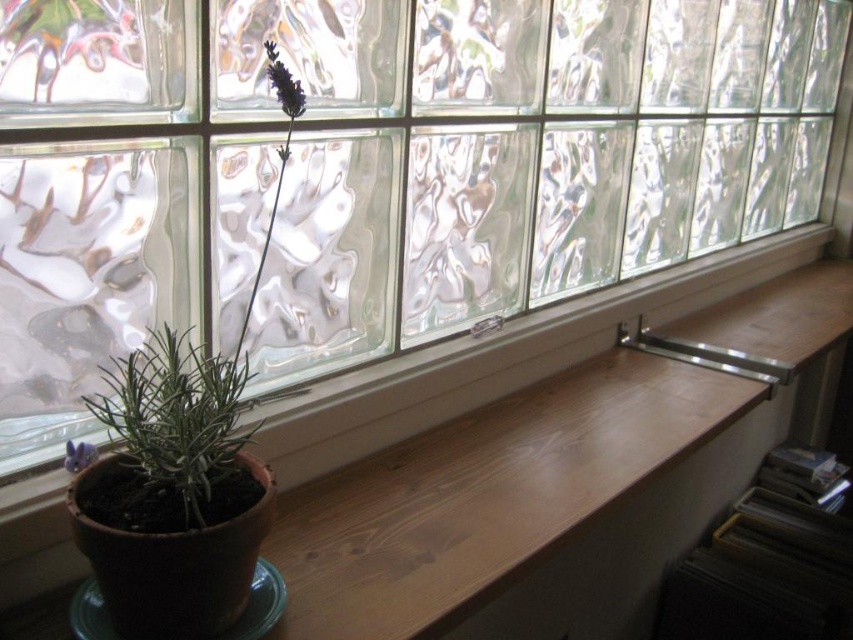
You are standing in front of the wooden window sill and need to place a small decorative item exactly at the point marked as point (x=555, y=476). Based on the scene description, where would this point be located?

The point (x=555, y=476) corresponds to the wooden ledge at lower center, so placing the item there would position it on the wooden window sill in the lower central area of the scene.

You are a delivery robot that needs to place a small package on the wooden window sill. The package must be placed exactly at the coordinates of the green matte plant at left. Where should you place the package?

The green matte plant at left is located at point (189,385), so place the package at those coordinates.

You are a small cat that wants to jump from the wooden ledge at lower center to the green matte plant at lower left. Can you reach the plant by jumping from the ledge?

The wooden ledge at lower center is located above the green matte plant at lower left, so the cat can jump down from the wooden ledge at lower center to the green matte plant at lower left.